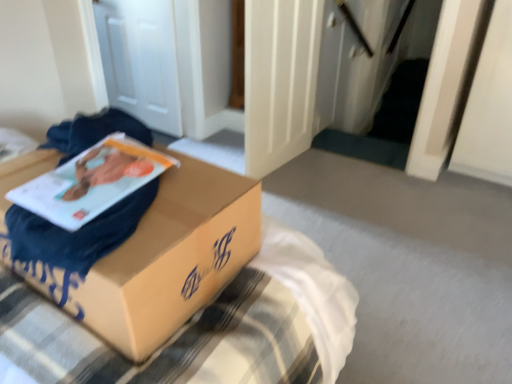
Image resolution: width=512 pixels, height=384 pixels. What do you see at coordinates (90, 186) in the screenshot?
I see `matte paper at center` at bounding box center [90, 186].

The image size is (512, 384). Find the location of `matte paper at center`. matte paper at center is located at coordinates (90, 186).

What do you see at coordinates (152, 253) in the screenshot? This screenshot has height=384, width=512. I see `matte cardboard box at center` at bounding box center [152, 253].

This screenshot has height=384, width=512. In order to click on matte cardboard box at center in this screenshot , I will do `click(152, 253)`.

The width and height of the screenshot is (512, 384). Find the location of `matte paper at center`. matte paper at center is located at coordinates (90, 186).

Considering the positions of objects matte paper at center and matte cardboard box at center in the image provided, who is more to the left, matte paper at center or matte cardboard box at center?

matte paper at center.

In the image, is matte paper at center positioned in front of or behind matte cardboard box at center?

Clearly, matte paper at center is behind matte cardboard box at center.

Does point (25, 195) lie in front of point (76, 277)?

No, it is behind (76, 277).

From the image's perspective, is matte paper at center under matte cardboard box at center?

No, from the image's perspective, matte paper at center is not beneath matte cardboard box at center.

From a real-world perspective, which is physically below, matte paper at center or matte cardboard box at center?

In real-world perspective, matte cardboard box at center is lower.

Which object is wider, matte paper at center or matte cardboard box at center?

Wider between the two is matte cardboard box at center.

Does matte paper at center have a lesser height compared to matte cardboard box at center?

Indeed, matte paper at center has a lesser height compared to matte cardboard box at center.

Which of these two, matte paper at center or matte cardboard box at center, is bigger?

Bigger between the two is matte cardboard box at center.

Is matte cardboard box at center completely or partially inside matte paper at center?

Definitely not — matte cardboard box at center is not inside matte paper at center.

Are matte paper at center and matte cardboard box at center located far from each other?

Actually, matte paper at center and matte cardboard box at center are a little close together.

Could you tell me if matte paper at center is facing matte cardboard box at center?

Yes.

Find the location of `paperback book located on the left of matte cardboard box at center`. paperback book located on the left of matte cardboard box at center is located at coordinates (90, 186).

Is matte cardboard box at center to the left or to the right of matte paper at center in the image?

Clearly, matte cardboard box at center is on the right of matte paper at center in the image.

Which object is more forward, matte cardboard box at center or matte paper at center?

matte cardboard box at center is closer to the camera.

Which is less distant, (84, 313) or (42, 211)?

Clearly, point (84, 313) is closer to the camera than point (42, 211).

From the image's perspective, is matte cardboard box at center under matte paper at center?

Indeed, from the image's perspective, matte cardboard box at center is shown beneath matte paper at center.

From a real-world perspective, is matte cardboard box at center above or below matte paper at center?

From a real-world perspective, matte cardboard box at center is physically below matte paper at center.

Which of these two, matte cardboard box at center or matte paper at center, is thinner?

matte paper at center.

Considering the sizes of objects matte cardboard box at center and matte paper at center in the image provided, who is taller, matte cardboard box at center or matte paper at center?

matte cardboard box at center is taller.

Can you confirm if matte cardboard box at center is smaller than matte paper at center?

Incorrect, matte cardboard box at center is not smaller in size than matte paper at center.

Is matte cardboard box at center inside or outside of matte paper at center?

matte cardboard box at center exists outside the volume of matte paper at center.

Is matte cardboard box at center touching matte paper at center?

No, matte cardboard box at center is not with matte paper at center.

Is matte cardboard box at center positioned with its back to matte paper at center?

No, matte paper at center is not at the back of matte cardboard box at center.

This screenshot has width=512, height=384. Find the location of `box below the matte paper at center (from a real-world perspective)`. box below the matte paper at center (from a real-world perspective) is located at coordinates (152, 253).

The height and width of the screenshot is (384, 512). Find the location of `paperback book behind the matte cardboard box at center`. paperback book behind the matte cardboard box at center is located at coordinates tap(90, 186).

Identify the location of box located underneath the matte paper at center (from a real-world perspective). The width and height of the screenshot is (512, 384). (152, 253).